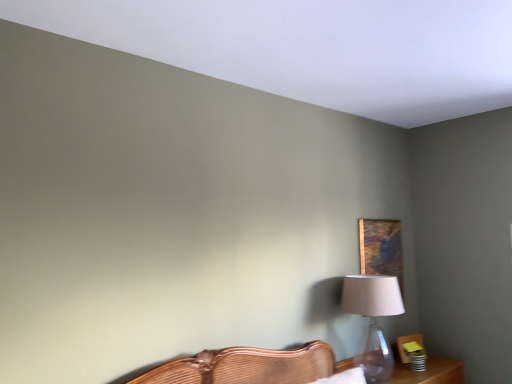
Measure the distance between wooden table at lower right and camera.

wooden table at lower right and camera are 2.75 meters apart from each other.

What do you see at coordinates (430, 372) in the screenshot? The height and width of the screenshot is (384, 512). I see `wooden table at lower right` at bounding box center [430, 372].

Locate an element on the screen. translucent glass table lamp at right is located at coordinates (373, 320).

In order to click on wooden table at lower right in this screenshot , I will do `click(430, 372)`.

In the scene shown: From a real-world perspective, is wooden painting at upper right positioned above or below wooden table at lower right?

In terms of real-world spatial position, wooden painting at upper right is above wooden table at lower right.

Can you confirm if wooden painting at upper right is thinner than wooden table at lower right?

Yes, wooden painting at upper right is thinner than wooden table at lower right.

Based on the photo, does wooden painting at upper right have a larger size compared to wooden table at lower right?

Actually, wooden painting at upper right might be smaller than wooden table at lower right.

Between wooden table at lower right and wooden painting at upper right, which one has smaller width?

wooden painting at upper right is thinner.

Between point (448, 381) and point (377, 229), which one is positioned behind?

The point (377, 229) is farther from the camera.

Who is smaller, wooden table at lower right or wooden painting at upper right?

wooden painting at upper right is smaller.

Where is `table beneath the translucent glass table lamp at right (from a real-world perspective)`? This screenshot has height=384, width=512. table beneath the translucent glass table lamp at right (from a real-world perspective) is located at coordinates (430, 372).

Between translucent glass table lamp at right and wooden table at lower right, which one has smaller width?

Thinner between the two is translucent glass table lamp at right.

Between translucent glass table lamp at right and wooden table at lower right, which one has smaller size?

translucent glass table lamp at right.

From a real-world perspective, is translucent glass table lamp at right above or below wooden table at lower right?

translucent glass table lamp at right is situated higher than wooden table at lower right in the real world.

Considering the sizes of objects wooden painting at upper right and translucent glass table lamp at right in the image provided, who is bigger, wooden painting at upper right or translucent glass table lamp at right?

translucent glass table lamp at right is bigger.

Is wooden painting at upper right with translucent glass table lamp at right?

wooden painting at upper right is not next to translucent glass table lamp at right, and they're not touching.

Consider the image. Who is taller, wooden painting at upper right or translucent glass table lamp at right?

With more height is wooden painting at upper right.

Which is more to the right, wooden painting at upper right or translucent glass table lamp at right?

wooden painting at upper right is more to the right.

Is translucent glass table lamp at right located within wooden table at lower right?

No.

Between wooden table at lower right and translucent glass table lamp at right, which one appears on the left side from the viewer's perspective?

translucent glass table lamp at right.

Is wooden table at lower right facing towards translucent glass table lamp at right?

No, wooden table at lower right does not turn towards translucent glass table lamp at right.

Considering the relative sizes of wooden table at lower right and translucent glass table lamp at right in the image provided, is wooden table at lower right wider than translucent glass table lamp at right?

Correct, the width of wooden table at lower right exceeds that of translucent glass table lamp at right.

From the image's perspective, between translucent glass table lamp at right and wooden painting at upper right, which one is located above?

wooden painting at upper right appears higher in the image.

Is point (367, 340) farther from camera compared to point (394, 270)?

No.

From a real-world perspective, is translucent glass table lamp at right beneath wooden painting at upper right?

Yes.

Is translucent glass table lamp at right oriented away from wooden painting at upper right?

No, wooden painting at upper right is not at the back of translucent glass table lamp at right.

Identify the location of table located on the right of wooden painting at upper right. (430, 372).

Locate an element on the screen. The width and height of the screenshot is (512, 384). table in front of the wooden painting at upper right is located at coordinates (430, 372).

Looking at the image, which one is located further to wooden painting at upper right, translucent glass table lamp at right or wooden table at lower right?

wooden table at lower right is further to wooden painting at upper right.

Estimate the real-world distances between objects in this image. Which object is further from translucent glass table lamp at right, wooden painting at upper right or wooden table at lower right?

wooden painting at upper right lies further to translucent glass table lamp at right than the other object.

Looking at the image, which one is located closer to wooden table at lower right, translucent glass table lamp at right or wooden painting at upper right?

The object closer to wooden table at lower right is translucent glass table lamp at right.

Based on their spatial positions, is wooden table at lower right or wooden painting at upper right further from translucent glass table lamp at right?

wooden painting at upper right is positioned further to the anchor translucent glass table lamp at right.

When comparing their distances from wooden table at lower right, does wooden painting at upper right or translucent glass table lamp at right seem closer?

Based on the image, translucent glass table lamp at right appears to be nearer to wooden table at lower right.

Looking at the image, which one is located further to wooden painting at upper right, wooden table at lower right or translucent glass table lamp at right?

wooden table at lower right lies further to wooden painting at upper right than the other object.

Identify the location of table lamp that lies between wooden painting at upper right and wooden table at lower right from top to bottom. This screenshot has height=384, width=512. (373, 320).